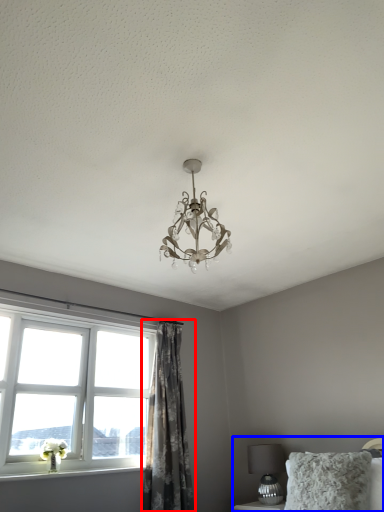
Question: Which point is closer to the camera, curtain (highlighted by a red box) or bed (highlighted by a blue box)?

Choices:
 (A) curtain
 (B) bed

Answer: (B)